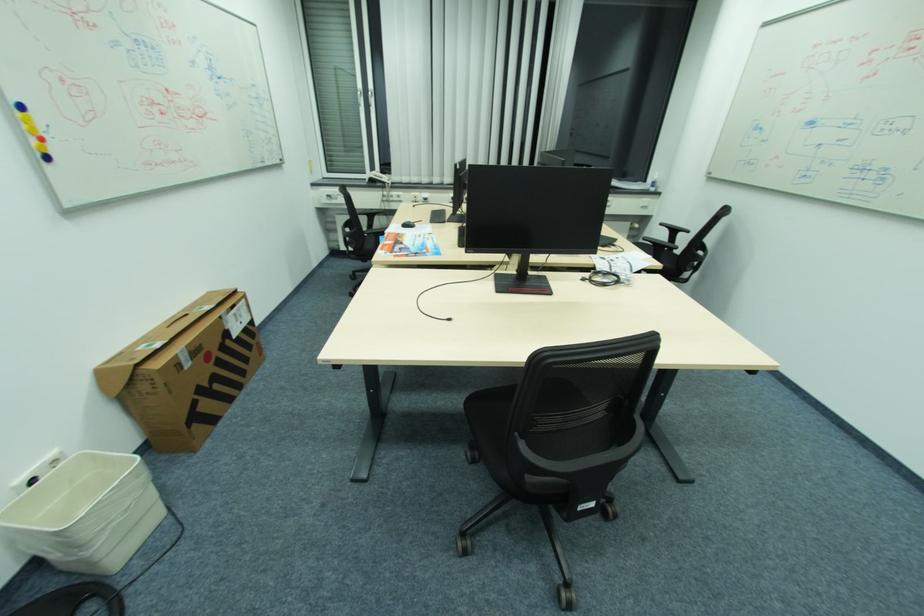
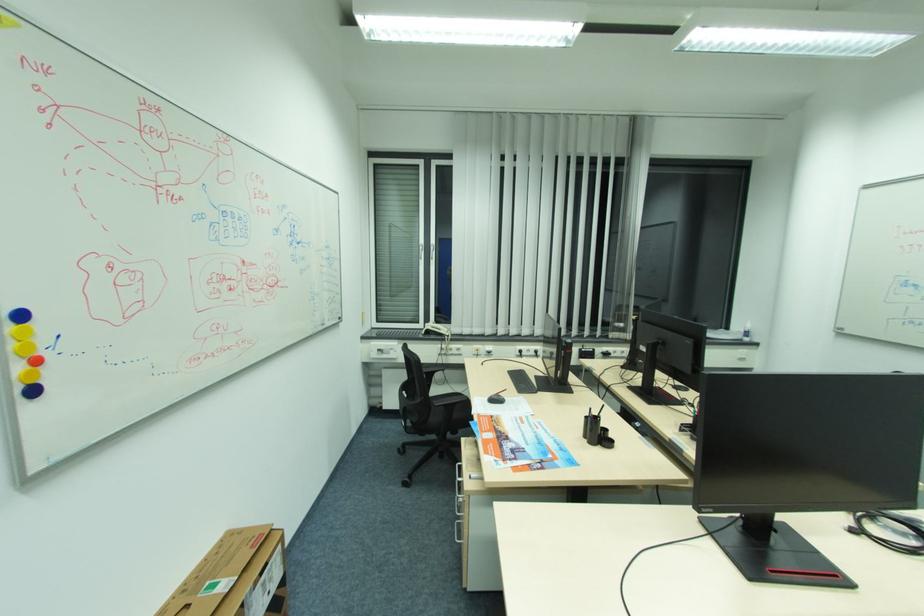
Question: Based on the continuous images, in which direction is the camera rotating? Reply with the corresponding letter.

Choices:
 (A) Left
 (B) Right
 (C) Up
 (D) Down

Answer: (C)